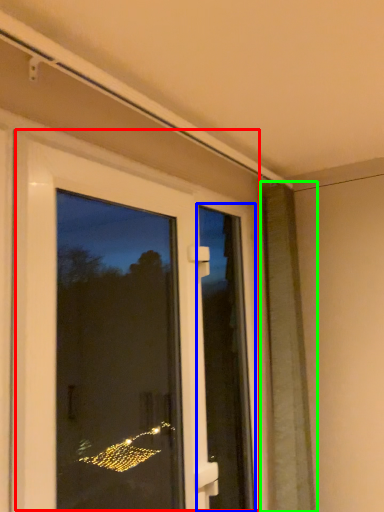
Question: Estimate the real-world distances between objects in this image. Which object is farther from door (highlighted by a red box), screen door (highlighted by a blue box) or shutter (highlighted by a green box)?

Choices:
 (A) screen door
 (B) shutter

Answer: (B)